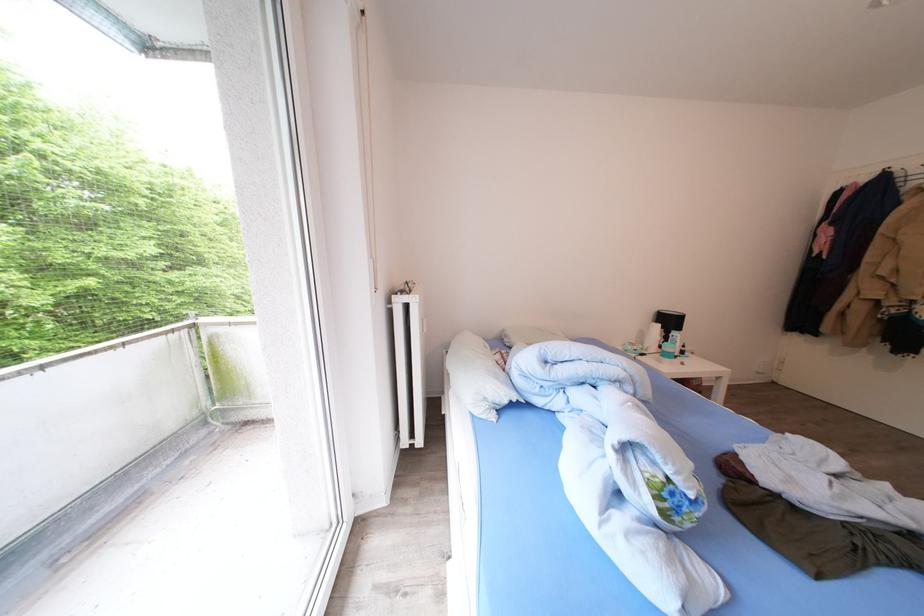
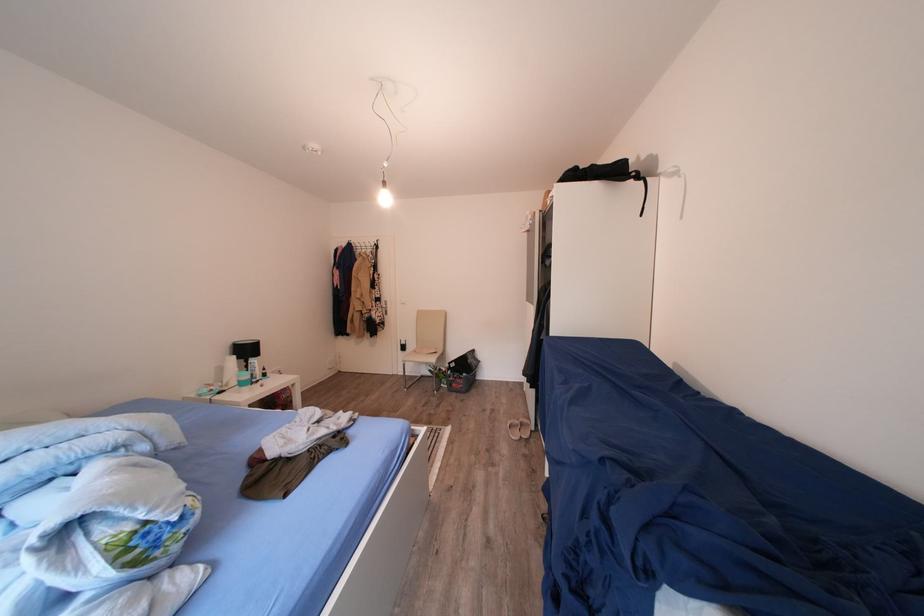
The point at (677,326) is marked in the first image. Where is the corresponding point in the second image?

(256, 355)